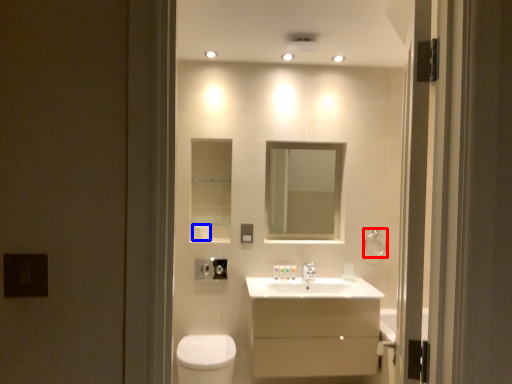
Question: Which of the following is the closest to the observer, towel bar (highlighted by a red box) or toilet paper (highlighted by a blue box)?

Choices:
 (A) towel bar
 (B) toilet paper

Answer: (B)